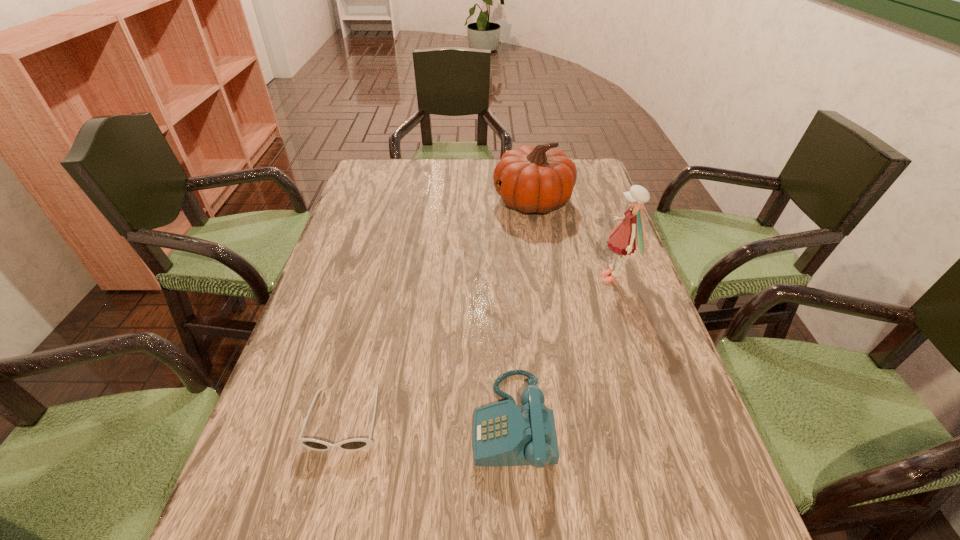
Locate an element on the screen. Image resolution: width=960 pixels, height=540 pixels. pumpkin present at the right edge is located at coordinates click(x=538, y=179).

Find the location of a particular element. object at the far right corner is located at coordinates (538, 179).

In the image, there is a desktop. Where is `free space at the far edge`? free space at the far edge is located at coordinates (493, 164).

In the image, there is a desktop. At what (x,y) coordinates should I click in order to perform the action: click on vacant region at the left edge. Please return your answer as a coordinate pair (x, y). Looking at the image, I should click on (295, 355).

Where is `free space at the right edge`? free space at the right edge is located at coordinates (606, 249).

Locate an element on the screen. This screenshot has width=960, height=540. vacant space at the far left corner of the desktop is located at coordinates (400, 168).

This screenshot has width=960, height=540. What are the coordinates of `vacant space at the far right corner of the desktop` in the screenshot? It's located at (577, 164).

The height and width of the screenshot is (540, 960). Find the location of `free space between the rightmost object and the telephone`. free space between the rightmost object and the telephone is located at coordinates (564, 350).

You are a GUI agent. You are given a task and a screenshot of the screen. Output one action in this format:
    pyautogui.click(x=<x>, y=<y>)
    Task: Click on the free spot between the tallest object and the shortest object
    
    Given the screenshot: What is the action you would take?
    pyautogui.click(x=479, y=349)

Locate an element on the screen. The image size is (960, 540). vacant area between the rightmost object and the leftmost object is located at coordinates (479, 349).